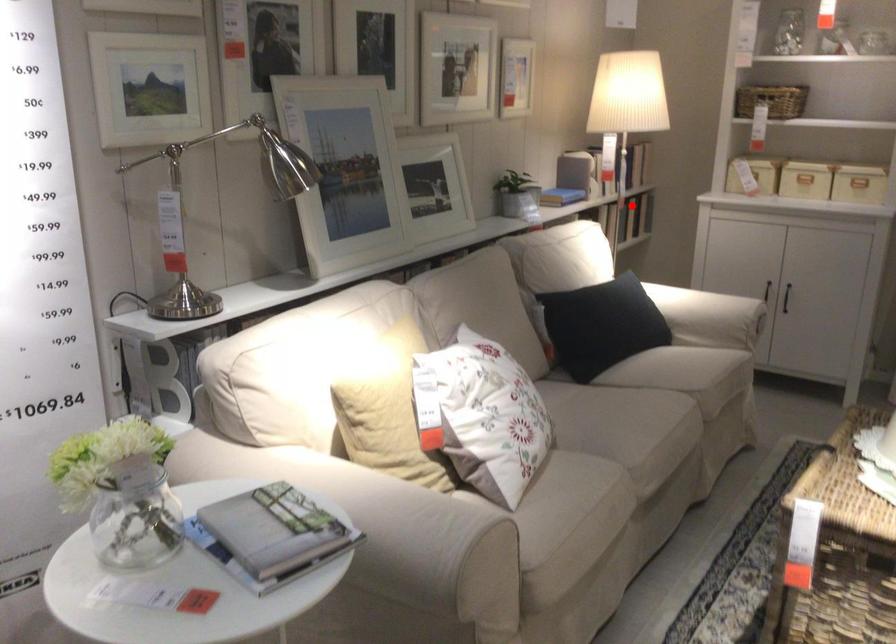
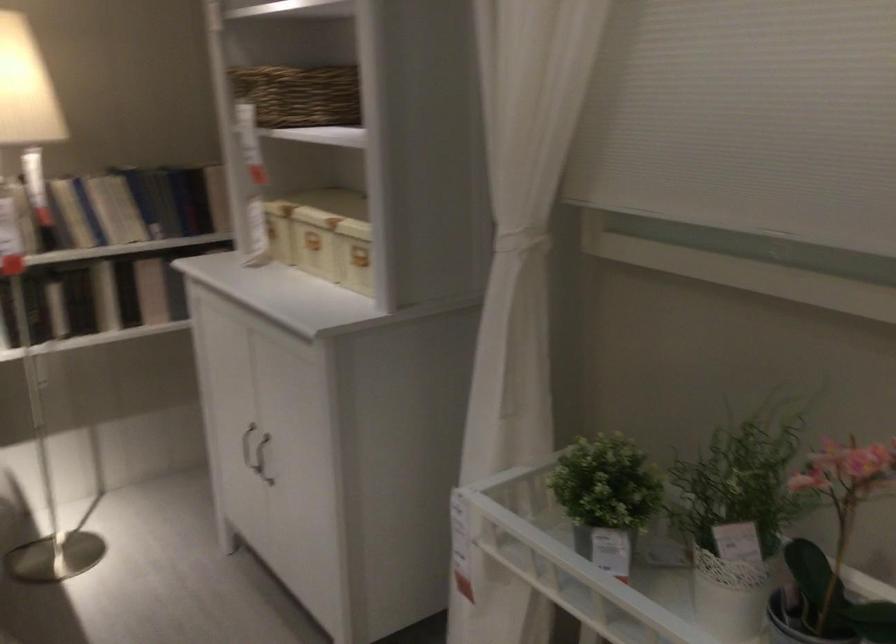
Question: I am providing you with two images of the same scene from different viewpoints. Image1 has a red point marked. In image2, the corresponding 3D location appears at what relative position? Reply with the corresponding letter.

Choices:
 (A) Closer
 (B) Farther

Answer: (A)